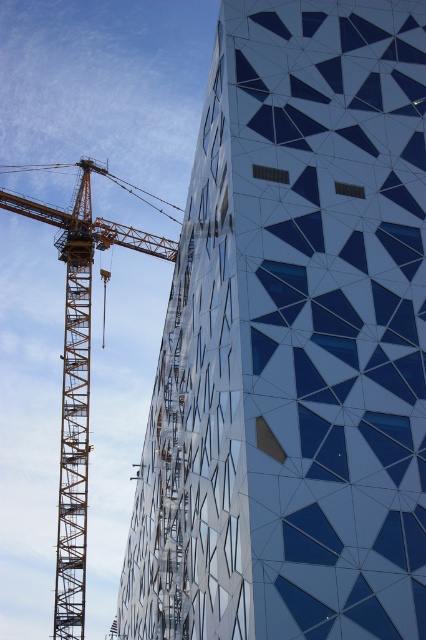
Is white glass building at center taller than orange metallic crane at left?

In fact, white glass building at center may be shorter than orange metallic crane at left.

The image size is (426, 640). In order to click on white glass building at center in this screenshot , I will do `click(293, 340)`.